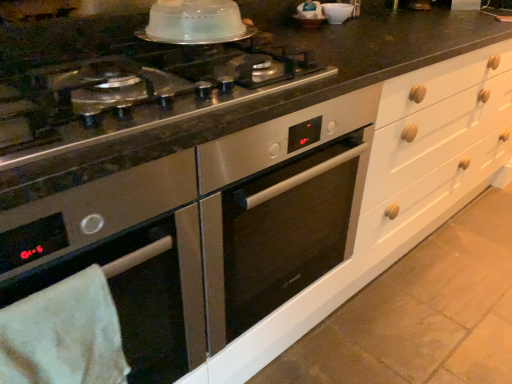
Question: Does clear plastic dome at upper center have a greater height compared to white glossy bowl at upper center?

Choices:
 (A) yes
 (B) no

Answer: (B)

Question: From a real-world perspective, is clear plastic dome at upper center physically below white glossy bowl at upper center?

Choices:
 (A) yes
 (B) no

Answer: (B)

Question: From the image's perspective, is clear plastic dome at upper center below white glossy bowl at upper center?

Choices:
 (A) no
 (B) yes

Answer: (B)

Question: Is clear plastic dome at upper center oriented towards white glossy bowl at upper center?

Choices:
 (A) no
 (B) yes

Answer: (A)

Question: Is clear plastic dome at upper center thinner than white glossy bowl at upper center?

Choices:
 (A) yes
 (B) no

Answer: (B)

Question: In terms of height, does white glossy bowl at upper center look taller or shorter compared to stainless steel cooktop at center?

Choices:
 (A) tall
 (B) short

Answer: (A)

Question: Considering the positions of white glossy bowl at upper center and stainless steel cooktop at center in the image, is white glossy bowl at upper center bigger or smaller than stainless steel cooktop at center?

Choices:
 (A) small
 (B) big

Answer: (A)

Question: From a real-world perspective, is white glossy bowl at upper center above or below stainless steel cooktop at center?

Choices:
 (A) above
 (B) below

Answer: (A)

Question: Considering their positions, is white glossy bowl at upper center located in front of or behind stainless steel cooktop at center?

Choices:
 (A) front
 (B) behind

Answer: (B)

Question: Is white towel at lower left bigger or smaller than stainless steel cooktop at center?

Choices:
 (A) big
 (B) small

Answer: (B)

Question: In the image, is white towel at lower left on the left side or the right side of stainless steel cooktop at center?

Choices:
 (A) left
 (B) right

Answer: (A)

Question: Is white towel at lower left inside or outside of stainless steel cooktop at center?

Choices:
 (A) outside
 (B) inside

Answer: (A)

Question: Does point (98, 294) appear closer or farther from the camera than point (409, 26)?

Choices:
 (A) closer
 (B) farther

Answer: (A)

Question: Is point (347, 21) closer or farther from the camera than point (342, 13)?

Choices:
 (A) farther
 (B) closer

Answer: (A)

Question: Considering the relative positions of stainless steel cooktop at center and white glossy bowl at upper center in the image provided, is stainless steel cooktop at center to the left or to the right of white glossy bowl at upper center?

Choices:
 (A) right
 (B) left

Answer: (B)